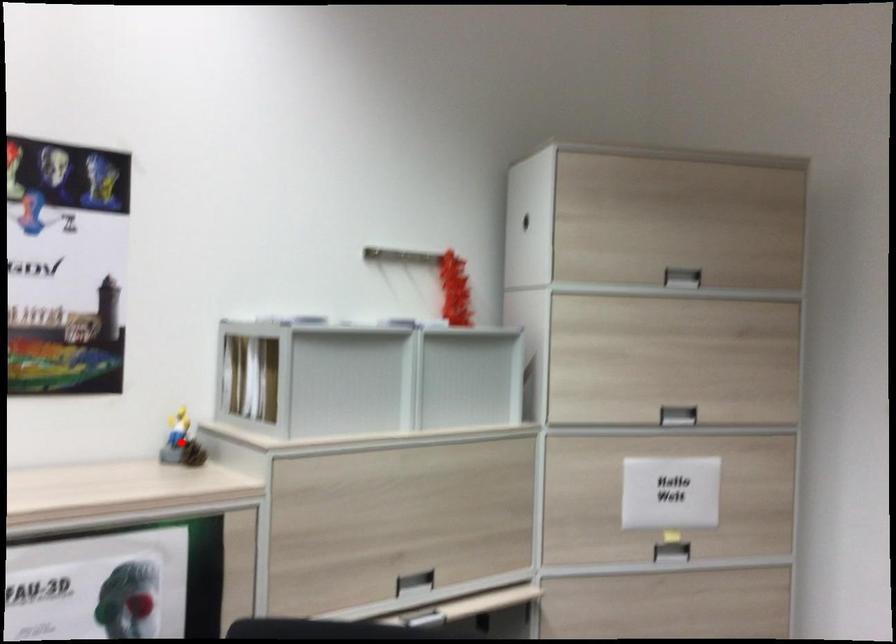
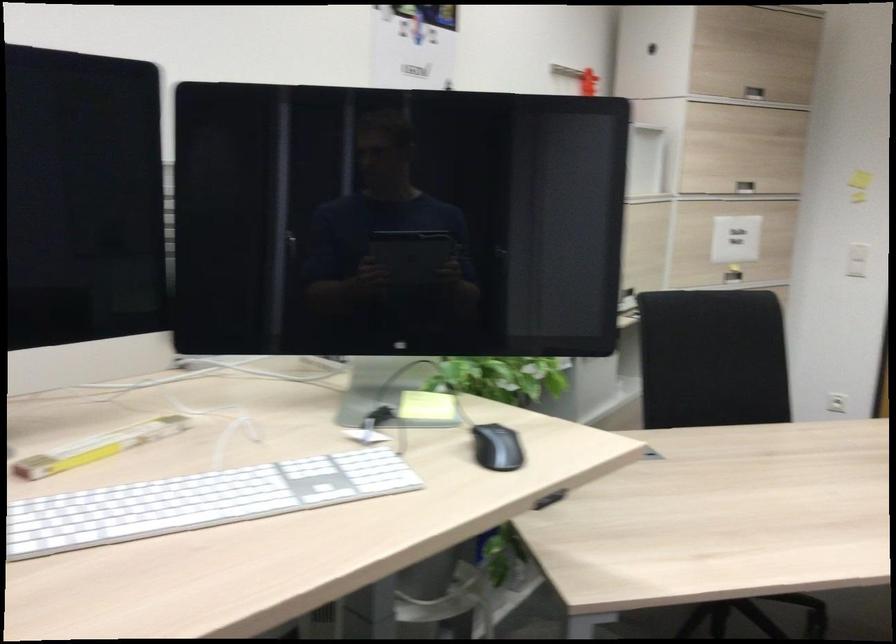
Question: I am providing you with two images of the same scene from different viewpoints. A red point is marked on the first image. Can you still see the location of the red point in image 2?

Choices:
 (A) Yes
 (B) No

Answer: (B)